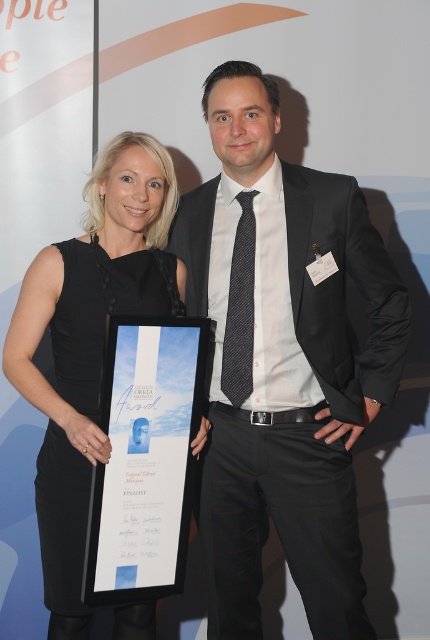
You are organizing a photo shoot and need to ensure there is enough space between the matte black suit at center and the black satin dress at left for a photographer to comfortably move around. The photographer requires at least 12 inches of space. Can the current spacing accommodate this requirement?

The matte black suit at center is 12.69 inches from the black satin dress at left, which exceeds the required 12 inches of space. Therefore, the current spacing can accommodate the photographer comfortably.

You are standing in front of the image and want to touch the point that is closer to the camera. Which point should you choose between point (x=331, y=602) and point (x=73, y=259)?

Point (x=73, y=259) is closer to the camera than point (x=331, y=602), so you should choose point (x=73, y=259).

Please describe the object located at point (282, 362) in the image.

The point (282, 362) is on matte black suit at center.